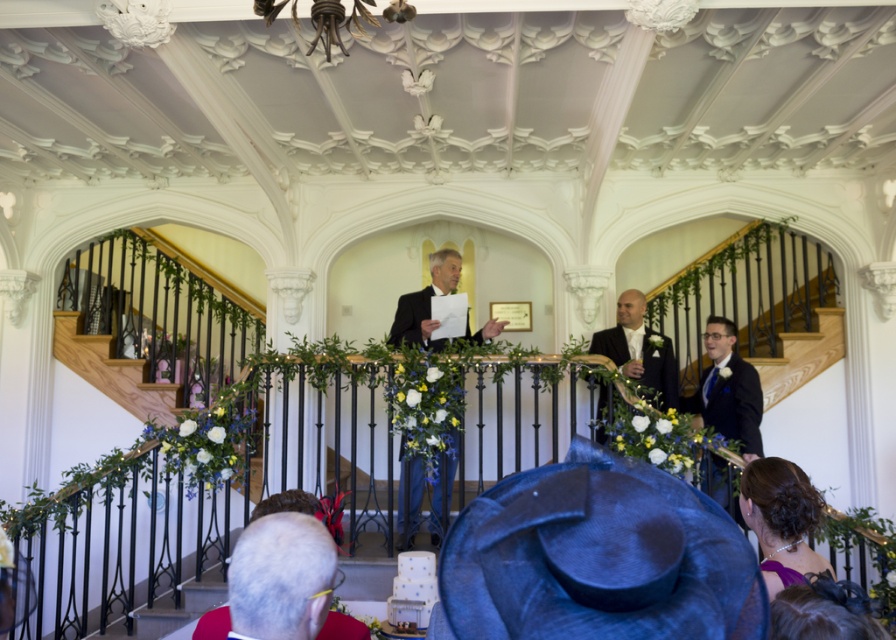
Which is behind, point (709, 332) or point (428, 525)?

The point (709, 332) is behind.

In the scene shown: Which is above, matte black suit at right or dark blue suit at center?

matte black suit at right

The height and width of the screenshot is (640, 896). I want to click on matte black suit at right, so click(x=727, y=390).

Is point (240, 577) farther from viewer compared to point (481, 332)?

No.

The width and height of the screenshot is (896, 640). What do you see at coordinates (281, 577) in the screenshot?
I see `gray matte hair at lower left` at bounding box center [281, 577].

Where is `gray matte hair at lower left`? gray matte hair at lower left is located at coordinates (281, 577).

The image size is (896, 640). What do you see at coordinates (781, 518) in the screenshot? I see `purple satin dress at lower right` at bounding box center [781, 518].

Is purple satin dress at lower right taller than black satin suit at center?

Incorrect, purple satin dress at lower right's height is not larger of black satin suit at center's.

What are the coordinates of `purple satin dress at lower right` in the screenshot? It's located at (781, 518).

You are a GUI agent. You are given a task and a screenshot of the screen. Output one action in this format:
    pyautogui.click(x=<x>, y=<y>)
    Task: Click on the purple satin dress at lower right
    Image resolution: width=896 pixels, height=640 pixels.
    Given the screenshot: What is the action you would take?
    pyautogui.click(x=781, y=518)